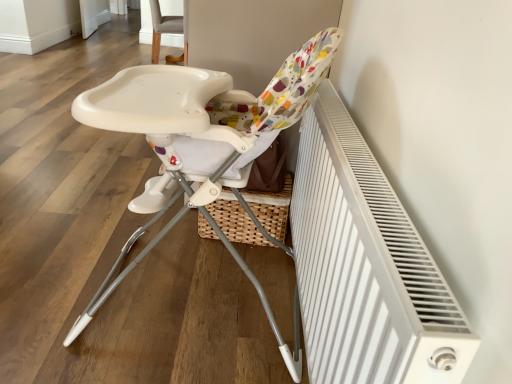
Question: Considering the relative sizes of white plastic highchair at center, positioned as the first chair in front-to-back order, and gray fabric chair at upper center, the second chair from the front, in the image provided, is white plastic highchair at center, positioned as the first chair in front-to-back order, shorter than gray fabric chair at upper center, the second chair from the front,?

Choices:
 (A) yes
 (B) no

Answer: (A)

Question: Considering the relative sizes of white plastic highchair at center, positioned as the first chair in front-to-back order, and gray fabric chair at upper center, the second chair from the front, in the image provided, is white plastic highchair at center, positioned as the first chair in front-to-back order, wider than gray fabric chair at upper center, the second chair from the front,?

Choices:
 (A) yes
 (B) no

Answer: (A)

Question: Does white plastic highchair at center, positioned as the first chair in front-to-back order, appear on the right side of gray fabric chair at upper center, the second chair from the front?

Choices:
 (A) yes
 (B) no

Answer: (B)

Question: From a real-world perspective, is white plastic highchair at center, the 2th chair from the back, located higher than gray fabric chair at upper center, the 1th chair from the back?

Choices:
 (A) yes
 (B) no

Answer: (B)

Question: Is white plastic highchair at center, the 2th chair from the back, aimed at gray fabric chair at upper center, the 1th chair from the back?

Choices:
 (A) no
 (B) yes

Answer: (A)

Question: From a real-world perspective, is white textured radiator at right physically located above or below gray fabric chair at upper center, the second chair from the front?

Choices:
 (A) below
 (B) above

Answer: (B)

Question: Is white textured radiator at right in front of or behind gray fabric chair at upper center, the 1th chair from the back, in the image?

Choices:
 (A) front
 (B) behind

Answer: (A)

Question: Is white textured radiator at right taller or shorter than gray fabric chair at upper center, the second chair from the front?

Choices:
 (A) tall
 (B) short

Answer: (B)

Question: Which is correct: white textured radiator at right is inside gray fabric chair at upper center, the second chair from the front, or outside of it?

Choices:
 (A) outside
 (B) inside

Answer: (A)

Question: In terms of height, does white plastic highchair at center, the 2th chair from the back, look taller or shorter compared to gray fabric chair at upper center, the second chair from the front?

Choices:
 (A) tall
 (B) short

Answer: (B)

Question: Which is correct: white plastic highchair at center, the 2th chair from the back, is inside gray fabric chair at upper center, the second chair from the front, or outside of it?

Choices:
 (A) outside
 (B) inside

Answer: (A)

Question: Looking at the image, does white plastic highchair at center, the 2th chair from the back, seem bigger or smaller compared to gray fabric chair at upper center, the second chair from the front?

Choices:
 (A) big
 (B) small

Answer: (A)

Question: From a real-world perspective, is white plastic highchair at center, the 2th chair from the back, physically located above or below gray fabric chair at upper center, the second chair from the front?

Choices:
 (A) above
 (B) below

Answer: (B)

Question: In the image, is gray fabric chair at upper center, the second chair from the front, positioned in front of or behind white plastic highchair at center, the 2th chair from the back?

Choices:
 (A) front
 (B) behind

Answer: (B)

Question: Is point (160, 28) closer or farther from the camera than point (148, 142)?

Choices:
 (A) closer
 (B) farther

Answer: (B)